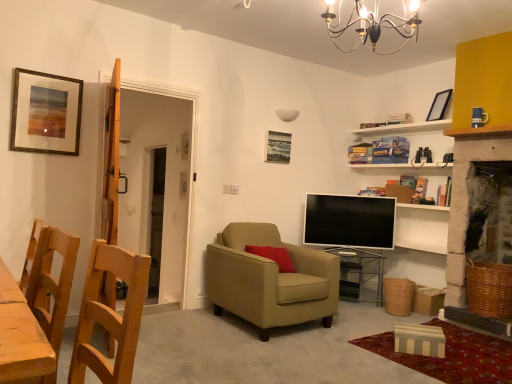
I want to click on vacant area that is in front of beige fabric armchair at center, which is the 3th chair from front to back, so click(285, 350).